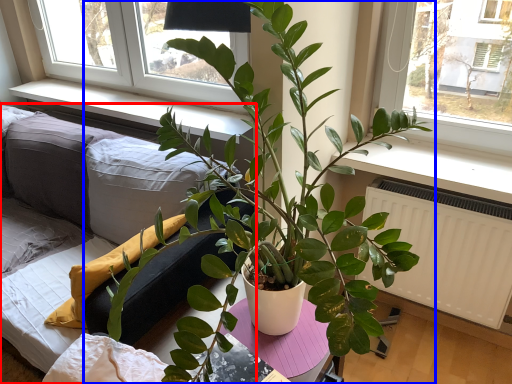
Question: Which object appears farthest to the camera in this image, studio couch (highlighted by a red box) or houseplant (highlighted by a blue box)?

Choices:
 (A) studio couch
 (B) houseplant

Answer: (A)